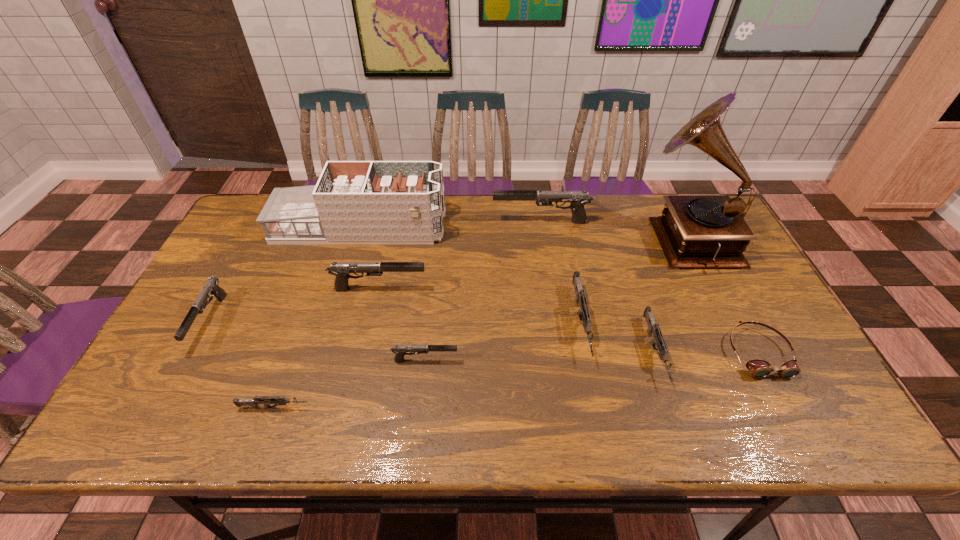
You are a GUI agent. You are given a task and a screenshot of the screen. Output one action in this format:
    pyautogui.click(x=<x>, y=<y>)
    Task: Click on the free space between the second grey gun from left to right and the brown record player
    The image size is (960, 540).
    Given the screenshot: What is the action you would take?
    pyautogui.click(x=634, y=280)

Identify the location of vacant region between the goggles and the sixth shortest gun. click(568, 320).

Where is `unoccupied position between the second smallest gray gun and the dollhouse`? This screenshot has width=960, height=540. unoccupied position between the second smallest gray gun and the dollhouse is located at coordinates (285, 274).

Where is `free spot between the second grey gun from left to right and the leftmost gun`? The image size is (960, 540). free spot between the second grey gun from left to right and the leftmost gun is located at coordinates (396, 322).

Identify which object is the fourth closest to the farthest gray gun. Please provide its 2D coordinates. Your answer should be formatted as a tuple, i.e. [(x, y)], where the tuple contains the x and y coordinates of a point satisfying the conditions above.

[(342, 270)]

I want to click on object that is the fifth closest to the record player, so [x=362, y=202].

Select which gun appears as the fifth closest to the nearest gray gun. Please provide its 2D coordinates. Your answer should be formatted as a tuple, i.e. [(x, y)], where the tuple contains the x and y coordinates of a point satisfying the conditions above.

[(211, 286)]

The image size is (960, 540). Find the location of `gun that is the fifth closest one to the dollhouse`. gun that is the fifth closest one to the dollhouse is located at coordinates (400, 350).

Identify which gray gun is the nearest to the second tallest object. Please provide its 2D coordinates. Your answer should be formatted as a tuple, i.e. [(x, y)], where the tuple contains the x and y coordinates of a point satisfying the conditions above.

[(578, 199)]

The width and height of the screenshot is (960, 540). In order to click on gray gun that stands as the second closest to the shortest gun in this screenshot , I will do `click(211, 286)`.